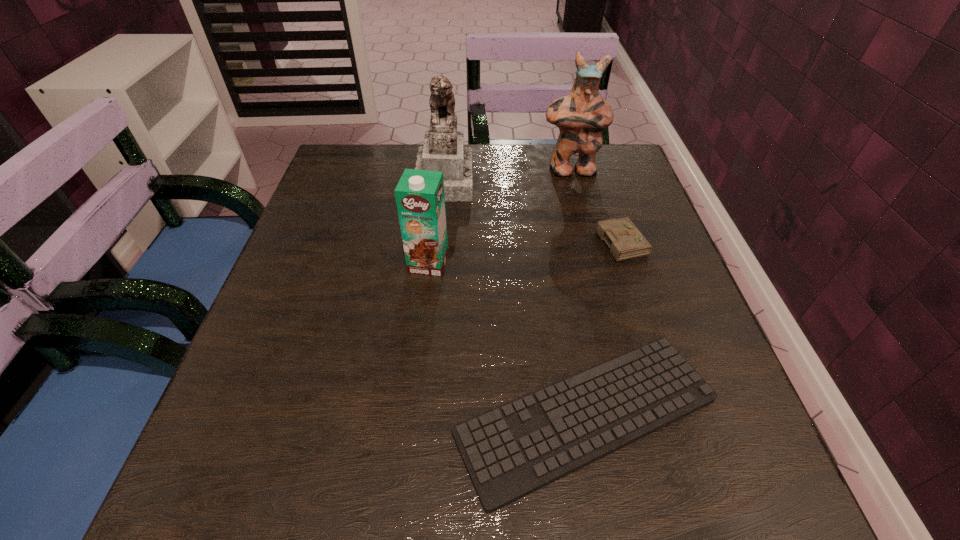
The height and width of the screenshot is (540, 960). I want to click on the right figurine, so click(x=581, y=116).

Identify the location of the left figurine. (443, 150).

Locate an element on the screen. Image resolution: width=960 pixels, height=540 pixels. the third shortest object is located at coordinates (420, 199).

The height and width of the screenshot is (540, 960). I want to click on diary, so click(x=625, y=241).

The height and width of the screenshot is (540, 960). I want to click on the nearest object, so click(512, 450).

Locate an element on the screen. computer keyboard is located at coordinates (512, 450).

Locate an element on the screen. Image resolution: width=960 pixels, height=540 pixels. vacant space located on the front-facing side of the right figurine is located at coordinates (577, 197).

Find the location of a particular element. The image size is (960, 540). free location located 0.090m on the front-facing side of the left figurine is located at coordinates (509, 179).

Locate an element on the screen. The image size is (960, 540). vacant region located 0.190m on the back of the third tallest object is located at coordinates (436, 196).

At what (x,y) coordinates should I click in order to perform the action: click on vacant area situated on the front of the diary. Please return your answer as a coordinate pair (x, y). The image size is (960, 540). Looking at the image, I should click on [x=637, y=291].